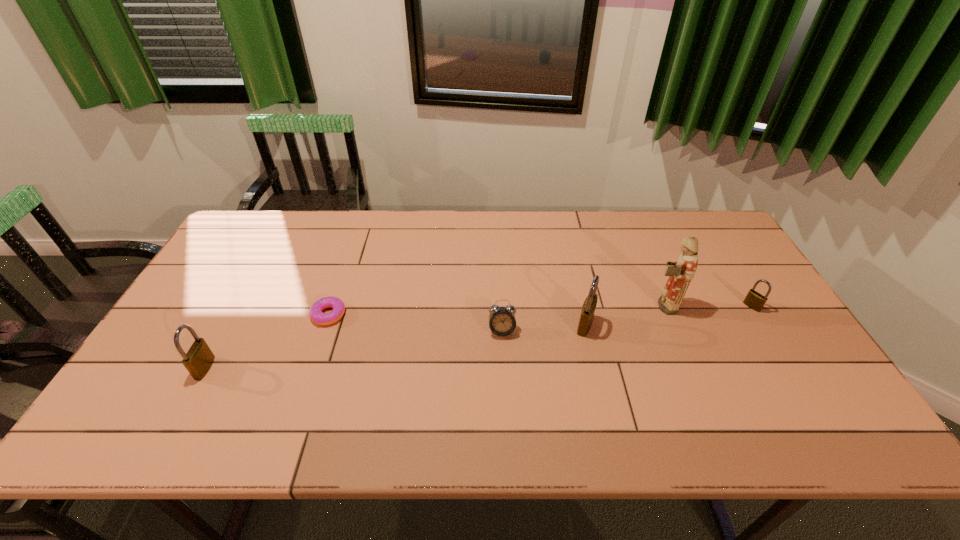
The width and height of the screenshot is (960, 540). In order to click on object situated at the left edge in this screenshot , I will do `click(198, 360)`.

Locate an element on the screen. The width and height of the screenshot is (960, 540). object that is positioned at the right edge is located at coordinates [x=754, y=300].

The image size is (960, 540). I want to click on object that is at the near left corner, so click(198, 360).

Where is `vacant point at the far edge`? Image resolution: width=960 pixels, height=540 pixels. vacant point at the far edge is located at coordinates (406, 228).

Locate an element on the screen. Image resolution: width=960 pixels, height=540 pixels. vacant space at the near edge of the desktop is located at coordinates pos(352,381).

Locate an element on the screen. This screenshot has width=960, height=540. free space at the left edge is located at coordinates (233, 258).

This screenshot has height=540, width=960. In the image, there is a desktop. Find the location of `free region at the right edge`. free region at the right edge is located at coordinates (729, 256).

Identify the location of free space that is in between the shortest object and the shortest padlock. point(540,310).

Find the location of a particular element. The image size is (960, 540). vacant area between the alarm clock and the leftmost padlock is located at coordinates (353, 349).

This screenshot has height=540, width=960. I want to click on vacant area that lies between the third object from left to right and the second padlock from left to right, so click(x=543, y=328).